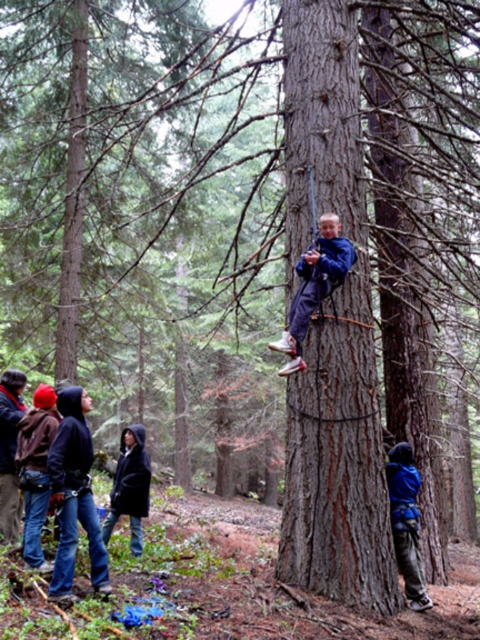
From the picture: You are standing at the base of the tree where the boy is climbing. You notice two points marked on the tree trunk. The first point is at coordinates point (324,250) and the second is at point (10,396). Which point is closer to you?

Point (324,250) is in front of point (10,396), so the first point is closer to you.

You are a hiker who has lost your jacket in the forest. You see the blue fleece jacket at center and the brushed metal jacket at lower left. Which jacket is closer to your current position?

The blue fleece jacket at center is closer to your current position because it is only 9.38 feet away from the brushed metal jacket at lower left, but without knowing your exact location, we can only compare their positions relative to each other. However, since the blue fleece jacket is at the center and the brushed metal jacket is at the lower left, if you are in the middle of the scene, the blue fleece jacket would be closer.